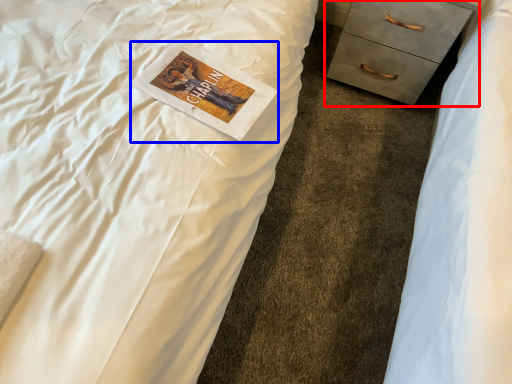
Question: Among these objects, which one is nearest to the camera, chest of drawers (highlighted by a red box) or paperback book (highlighted by a blue box)?

Choices:
 (A) chest of drawers
 (B) paperback book

Answer: (B)